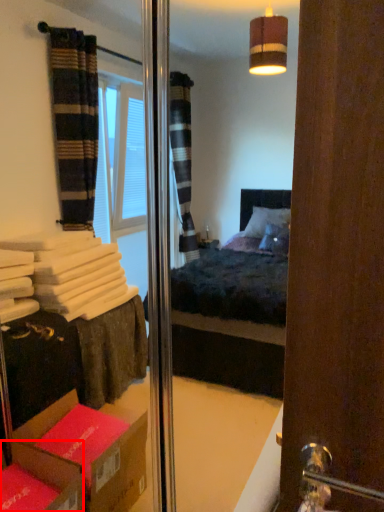
Question: From the image's perspective, what is the correct spatial relationship of cardboard box (annotated by the red box) in relation to door handle?

Choices:
 (A) above
 (B) below

Answer: (B)